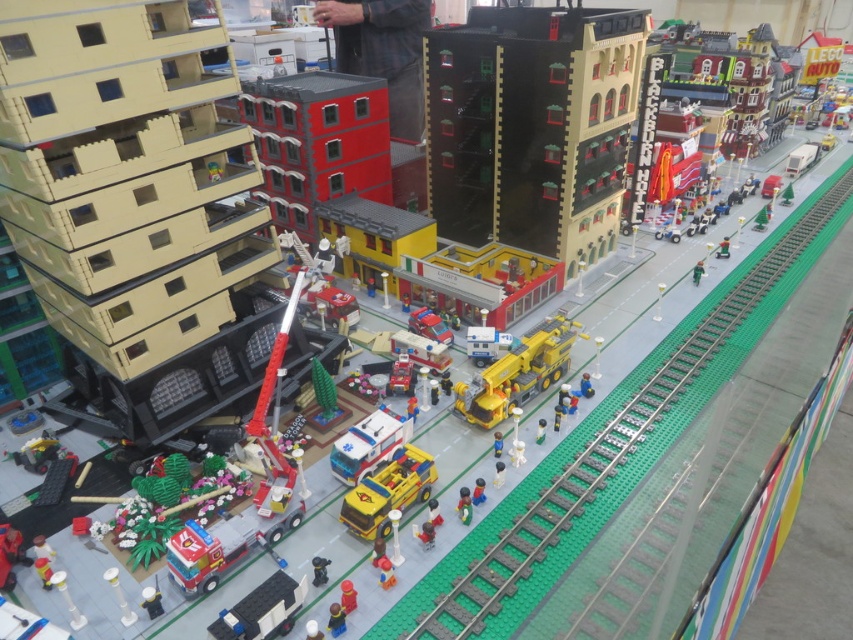
Question: Which point appears farthest from the camera in this image?

Choices:
 (A) (302, 580)
 (B) (460, 499)
 (C) (39, 573)

Answer: (B)

Question: Does dark blue shirt at center have a smaller size compared to light blue plastic figure at center?

Choices:
 (A) no
 (B) yes

Answer: (A)

Question: Which point is farther to the camera?

Choices:
 (A) (699, 282)
 (B) (403, 356)
 (C) (468, 417)

Answer: (A)

Question: Which is nearer to the dark blue shirt at center?

Choices:
 (A) green matte figure at lower center
 (B) shiny red fire truck at center
 (C) light blue plastic figure at center

Answer: (B)

Question: Does green plastic train track at center-right have a lesser width compared to translucent blue plastic ambulance at center?

Choices:
 (A) no
 (B) yes

Answer: (B)

Question: In this image, where is translucent blue plastic ambulance at center located relative to light blue plastic person at center?

Choices:
 (A) right
 (B) left

Answer: (B)